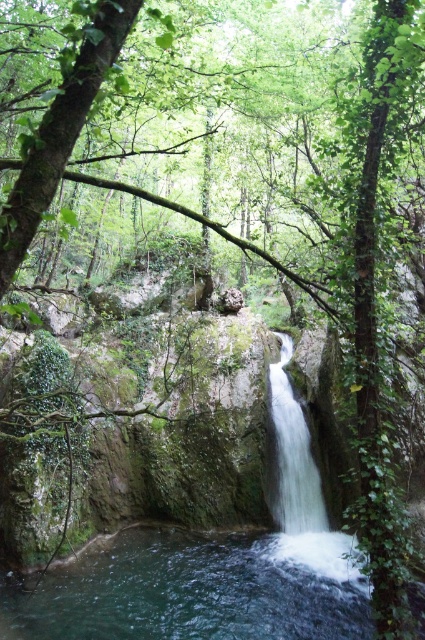
Question: Does clear water at center come in front of white smooth waterfall at center?

Choices:
 (A) no
 (B) yes

Answer: (B)

Question: Where is clear water at center located in relation to white smooth waterfall at center in the image?

Choices:
 (A) below
 (B) above

Answer: (A)

Question: Is clear water at center to the left of white smooth waterfall at center from the viewer's perspective?

Choices:
 (A) no
 (B) yes

Answer: (B)